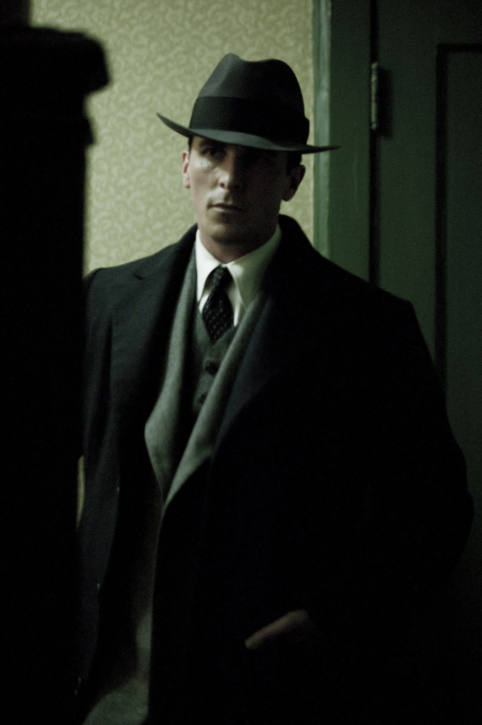
Image resolution: width=482 pixels, height=725 pixels. I want to click on door hinge, so click(377, 88).